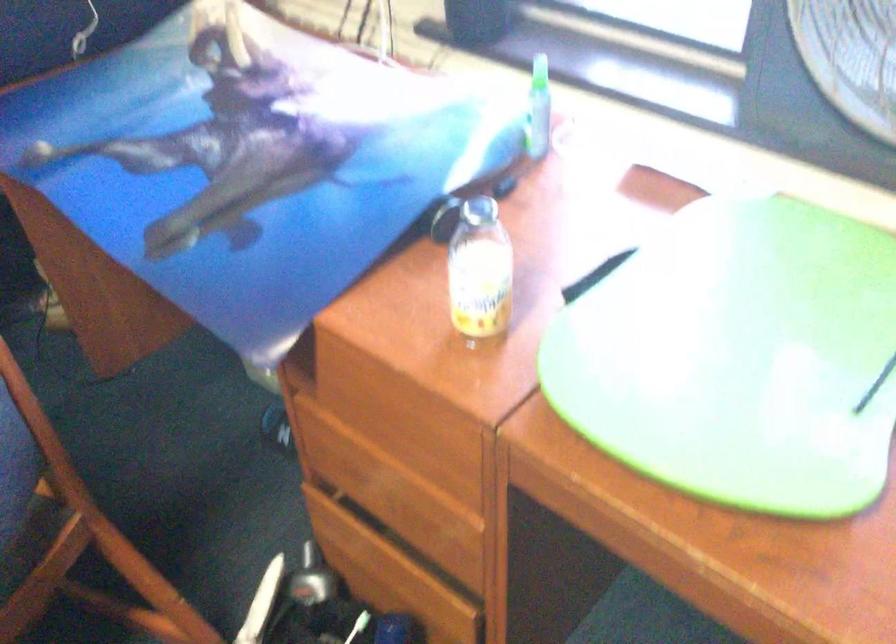
This screenshot has height=644, width=896. I want to click on chair sitting surface, so click(30, 540).